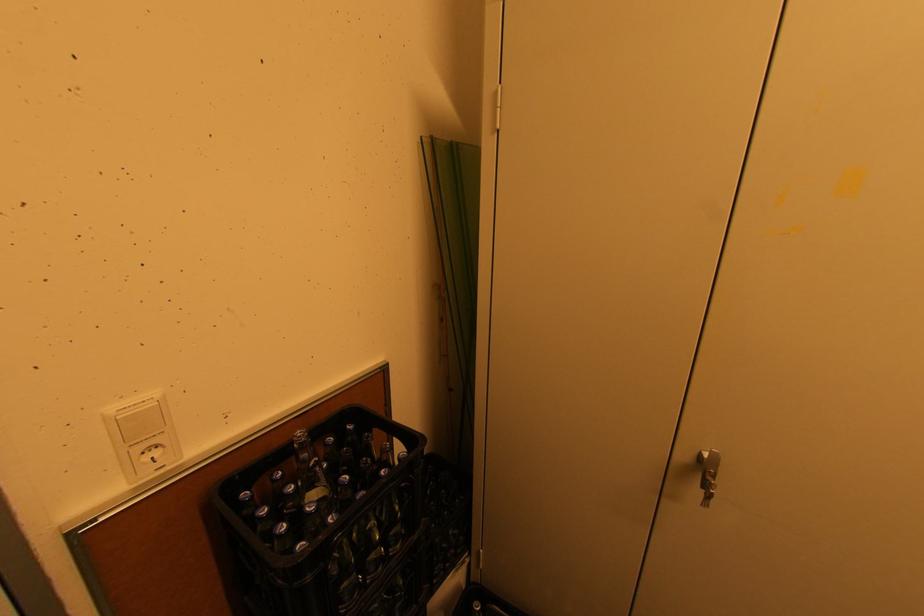
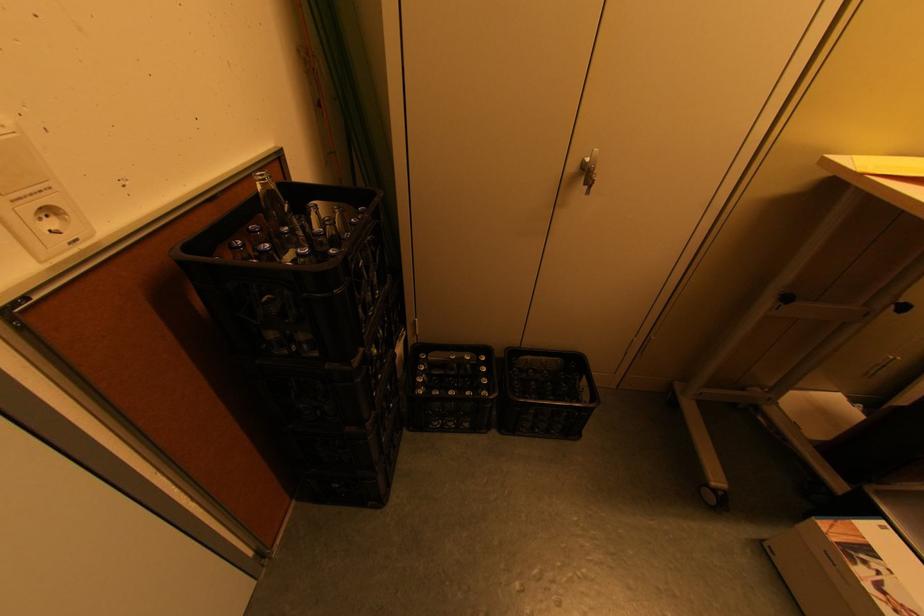
In the second image, find the point that corresponds to point (704, 488) in the first image.

(588, 185)